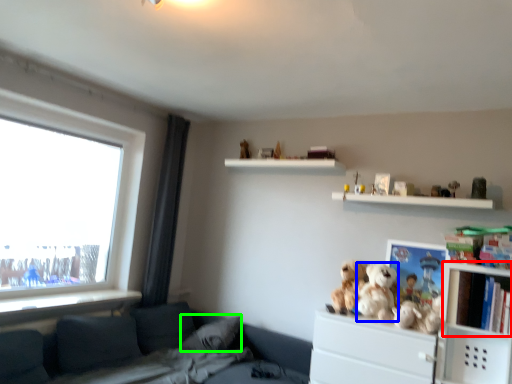
Question: Based on their relative distances, which object is farther from cabinet (highlighted by a red box)? Choose from toy (highlighted by a blue box) and pillow (highlighted by a green box).

Choices:
 (A) toy
 (B) pillow

Answer: (B)